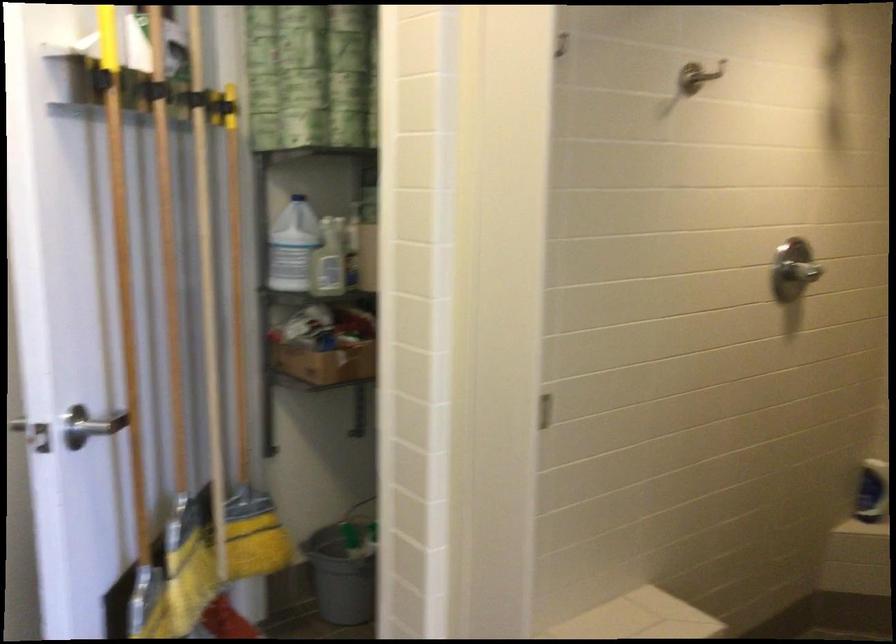
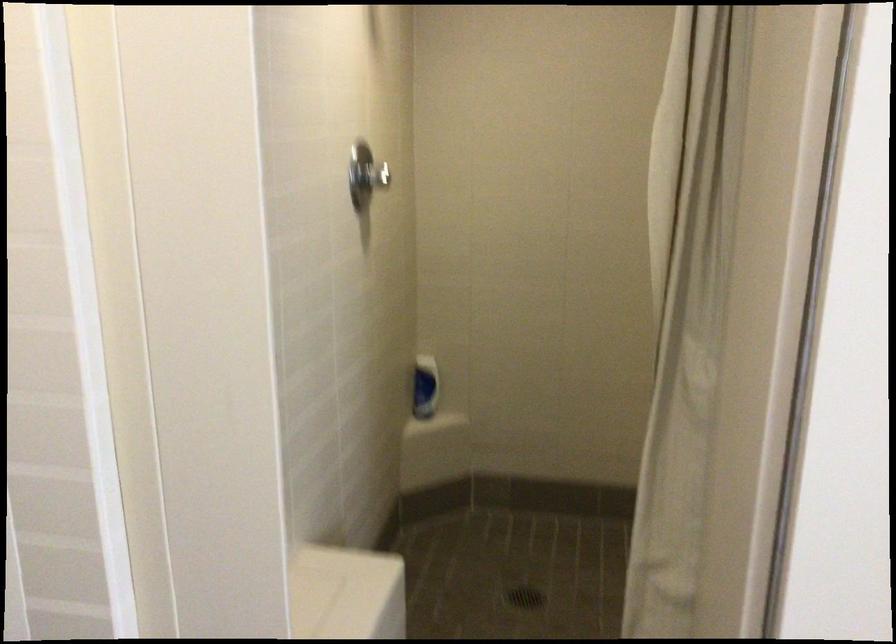
Question: The camera is either moving clockwise (left) or counter-clockwise (right) around the object. The first image is from the beginning of the video and the second image is from the end. Is the camera moving left or right when shooting the video?

Choices:
 (A) Left
 (B) Right

Answer: (A)